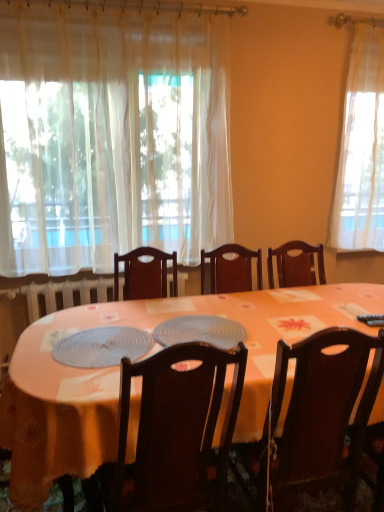
Where is `translucent plastic platter at center, which is the second platter from right to left`? translucent plastic platter at center, which is the second platter from right to left is located at coordinates (102, 347).

The height and width of the screenshot is (512, 384). I want to click on translucent plastic placemat at center, marked as the 2th platter in a left-to-right arrangement, so click(200, 331).

Is translucent plastic placemat at center, marked as the 2th platter in a left-to-right arrangement, taller or shorter than white sheer curtain at upper left?

Considering their sizes, translucent plastic placemat at center, marked as the 2th platter in a left-to-right arrangement, has less height than white sheer curtain at upper left.

In the scene shown: From the image's perspective, would you say translucent plastic placemat at center, marked as the 2th platter in a left-to-right arrangement, is positioned over white sheer curtain at upper left?

No, from the image's perspective, translucent plastic placemat at center, marked as the 2th platter in a left-to-right arrangement, is not over white sheer curtain at upper left.

Consider the image. From a real-world perspective, which object rests below the other?

In real-world perspective, translucent plastic placemat at center, marked as the 2th platter in a left-to-right arrangement, is lower.

Between translucent plastic placemat at center, marked as the 2th platter in a left-to-right arrangement, and white sheer curtain at upper left, which one appears on the left side from the viewer's perspective?

Positioned to the left is white sheer curtain at upper left.

Is translucent plastic platter at center, positioned as the 1th platter in left-to-right order, aimed at orange fabric table at center?

Yes.

Who is more distant, translucent plastic platter at center, positioned as the 1th platter in left-to-right order, or orange fabric table at center?

translucent plastic platter at center, positioned as the 1th platter in left-to-right order.

Looking at this image, from the image's perspective, is translucent plastic platter at center, positioned as the 1th platter in left-to-right order, below orange fabric table at center?

No.

Is point (363, 334) behind point (207, 467)?

No, it is in front of (207, 467).

The height and width of the screenshot is (512, 384). Identify the location of chair below the dark wood chair at center, arranged as the 2th chair when viewed from the right (from a real-world perspective). (322, 419).

Visually, is dark wood chair at center, which ranks as the 1th chair in right-to-left order, positioned to the left or to the right of dark wood chair at center, arranged as the 2th chair when viewed from the right?

dark wood chair at center, which ranks as the 1th chair in right-to-left order, is positioned on dark wood chair at center, arranged as the 2th chair when viewed from the right,'s right side.

Does translucent plastic placemat at center, marked as the first platter in a right-to-left arrangement, touch dark wood chair at center, arranged as the 2th chair when viewed from the right?

No, translucent plastic placemat at center, marked as the first platter in a right-to-left arrangement, is not making contact with dark wood chair at center, arranged as the 2th chair when viewed from the right.

Between translucent plastic placemat at center, marked as the 2th platter in a left-to-right arrangement, and dark wood chair at center, which is counted as the first chair, starting from the left, which one appears on the right side from the viewer's perspective?

Positioned to the right is translucent plastic placemat at center, marked as the 2th platter in a left-to-right arrangement.

From a real-world perspective, is translucent plastic placemat at center, marked as the 2th platter in a left-to-right arrangement, over dark wood chair at center, arranged as the 2th chair when viewed from the right?

Yes, from a real-world perspective, translucent plastic placemat at center, marked as the 2th platter in a left-to-right arrangement, is on top of dark wood chair at center, arranged as the 2th chair when viewed from the right.

Considering the relative sizes of translucent plastic placemat at center, marked as the 2th platter in a left-to-right arrangement, and dark wood chair at center, which is counted as the first chair, starting from the left, in the image provided, is translucent plastic placemat at center, marked as the 2th platter in a left-to-right arrangement, wider than dark wood chair at center, which is counted as the first chair, starting from the left,?

Yes.

Would you consider orange fabric table at center to be distant from translucent plastic placemat at center, marked as the 2th platter in a left-to-right arrangement?

Actually, orange fabric table at center and translucent plastic placemat at center, marked as the 2th platter in a left-to-right arrangement, are a little close together.

Does orange fabric table at center have a smaller size compared to translucent plastic placemat at center, marked as the first platter in a right-to-left arrangement?

No.

Considering the sizes of objects orange fabric table at center and translucent plastic placemat at center, marked as the 2th platter in a left-to-right arrangement, in the image provided, who is wider, orange fabric table at center or translucent plastic placemat at center, marked as the 2th platter in a left-to-right arrangement,?

orange fabric table at center is wider.

From a real-world perspective, is orange fabric table at center located higher than translucent plastic placemat at center, marked as the 2th platter in a left-to-right arrangement?

Actually, orange fabric table at center is physically below translucent plastic placemat at center, marked as the 2th platter in a left-to-right arrangement, in the real world.

Looking at the image, does dark wood chair at center, arranged as the 2th chair when viewed from the right, seem bigger or smaller compared to orange fabric table at center?

Considering their sizes, dark wood chair at center, arranged as the 2th chair when viewed from the right, takes up less space than orange fabric table at center.

From the image's perspective, who appears lower, dark wood chair at center, arranged as the 2th chair when viewed from the right, or orange fabric table at center?

orange fabric table at center is shown below in the image.

Is dark wood chair at center, arranged as the 2th chair when viewed from the right, wider or thinner than orange fabric table at center?

Considering their sizes, dark wood chair at center, arranged as the 2th chair when viewed from the right, looks slimmer than orange fabric table at center.

Which is more to the right, dark wood chair at center, which is counted as the first chair, starting from the left, or orange fabric table at center?

orange fabric table at center is more to the right.

In the scene shown: Would you consider translucent plastic platter at center, positioned as the 1th platter in left-to-right order, to be distant from white sheer curtain at upper left?

Yes, translucent plastic platter at center, positioned as the 1th platter in left-to-right order, and white sheer curtain at upper left are quite far apart.

Looking at this image, from the image's perspective, would you say translucent plastic platter at center, positioned as the 1th platter in left-to-right order, is positioned over white sheer curtain at upper left?

No, from the image's perspective, translucent plastic platter at center, positioned as the 1th platter in left-to-right order, is not over white sheer curtain at upper left.

Locate an element on the screen. This screenshot has height=512, width=384. curtain above the translucent plastic platter at center, which is the second platter from right to left (from a real-world perspective) is located at coordinates (105, 136).

Who is bigger, translucent plastic platter at center, positioned as the 1th platter in left-to-right order, or white sheer curtain at upper left?

white sheer curtain at upper left is bigger.

I want to click on the 1st platter in front when counting from the white sheer curtain at upper left, so click(x=200, y=331).

From the orange fabric table at center, count the 2nd platter to the left and point to it. Please provide its 2D coordinates.

[(102, 347)]

Looking at the image, which one is located closer to translucent plastic platter at center, positioned as the 1th platter in left-to-right order, orange fabric table at center or dark wood chair at center, which is counted as the first chair, starting from the left?

orange fabric table at center is positioned closer to the anchor translucent plastic platter at center, positioned as the 1th platter in left-to-right order.

Based on their spatial positions, is white sheer curtain at upper left or dark wood chair at center, which is counted as the first chair, starting from the left, further from orange fabric table at center?

The object further to orange fabric table at center is white sheer curtain at upper left.

From the picture: Looking at the image, which one is located closer to dark wood chair at center, positioned as the second chair in left-to-right order, translucent plastic placemat at center, marked as the first platter in a right-to-left arrangement, or orange fabric table at center?

Among the two, orange fabric table at center is located nearer to dark wood chair at center, positioned as the second chair in left-to-right order.

Based on their spatial positions, is translucent plastic placemat at center, marked as the first platter in a right-to-left arrangement, or dark wood chair at center, which is counted as the first chair, starting from the left, closer to orange fabric table at center?

The object closer to orange fabric table at center is translucent plastic placemat at center, marked as the first platter in a right-to-left arrangement.

Based on their spatial positions, is orange fabric table at center or dark wood chair at center, positioned as the second chair in left-to-right order, closer to dark wood chair at center, which is counted as the first chair, starting from the left?

Based on the image, dark wood chair at center, positioned as the second chair in left-to-right order, appears to be nearer to dark wood chair at center, which is counted as the first chair, starting from the left.

Which object lies nearer to the anchor point dark wood chair at center, which is counted as the first chair, starting from the left, white sheer curtain at upper left or dark wood chair at center, positioned as the second chair in left-to-right order?

dark wood chair at center, positioned as the second chair in left-to-right order, is positioned closer to the anchor dark wood chair at center, which is counted as the first chair, starting from the left.

Which object lies nearer to the anchor point orange fabric table at center, dark wood chair at center, arranged as the 2th chair when viewed from the right, or dark wood chair at center, positioned as the second chair in left-to-right order?

Among the two, dark wood chair at center, arranged as the 2th chair when viewed from the right, is located nearer to orange fabric table at center.

From the image, which object appears to be farther from dark wood chair at center, arranged as the 2th chair when viewed from the right, white sheer curtain at upper left or translucent plastic platter at center, which is the second platter from right to left?

white sheer curtain at upper left.

Where is `desk located between translucent plastic platter at center, which is the second platter from right to left, and dark wood chair at center, which ranks as the 1th chair in right-to-left order, in the left-right direction`? desk located between translucent plastic platter at center, which is the second platter from right to left, and dark wood chair at center, which ranks as the 1th chair in right-to-left order, in the left-right direction is located at coordinates (118, 374).

I want to click on platter between translucent plastic platter at center, which is the second platter from right to left, and orange fabric table at center, so click(200, 331).

This screenshot has width=384, height=512. What are the coordinates of `platter between translucent plastic platter at center, which is the second platter from right to left, and dark wood chair at center, positioned as the second chair in left-to-right order, in the horizontal direction` in the screenshot? It's located at (200, 331).

Where is `chair between translucent plastic platter at center, positioned as the 1th platter in left-to-right order, and dark wood chair at center, positioned as the second chair in left-to-right order, from left to right`? chair between translucent plastic platter at center, positioned as the 1th platter in left-to-right order, and dark wood chair at center, positioned as the second chair in left-to-right order, from left to right is located at coordinates (178, 429).